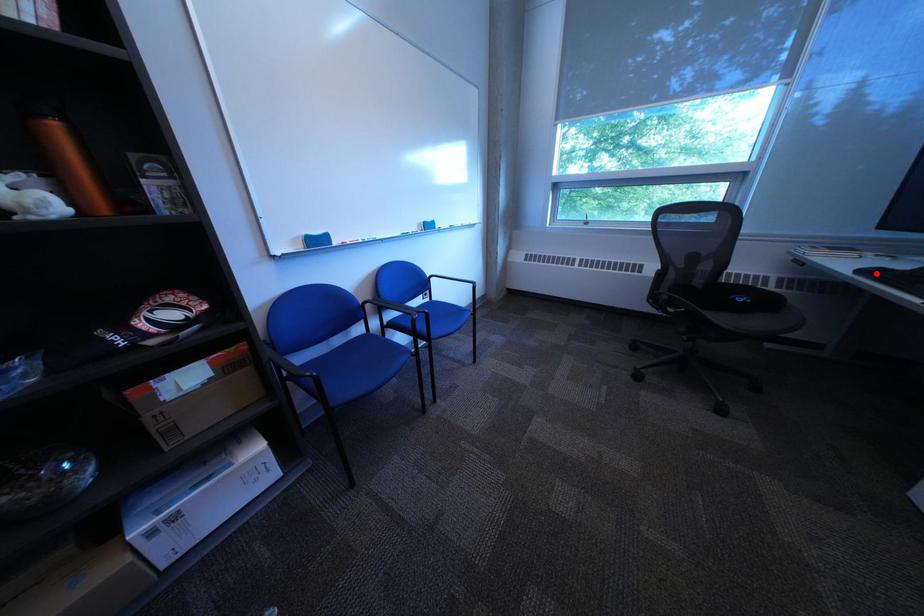
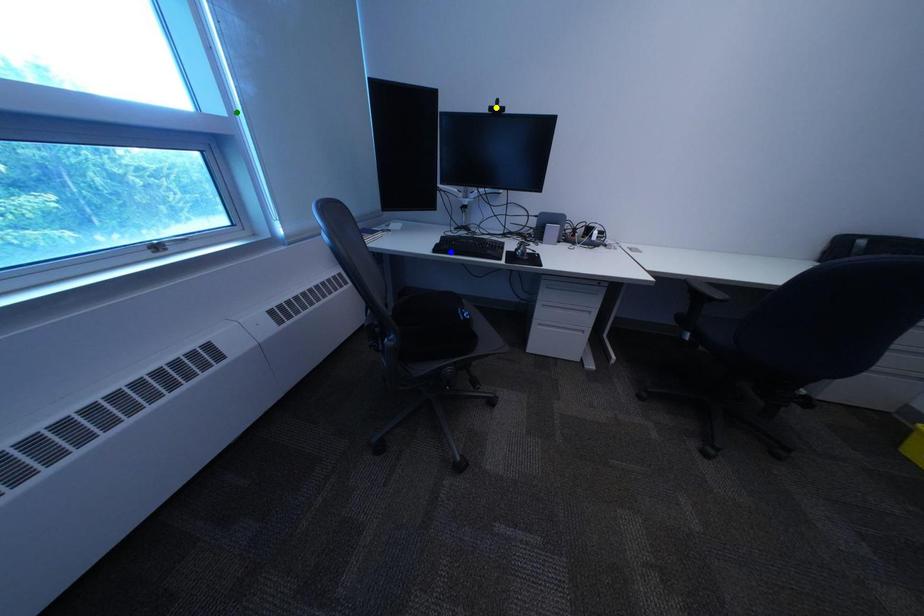
Question: I am providing you with two images of the same scene from different viewpoints. A red point is marked on the first image. You are given multiple points on the second image. Which mark in image 2 goes with the point in image 1?

Choices:
 (A) blue point
 (B) green point
 (C) yellow point

Answer: (A)